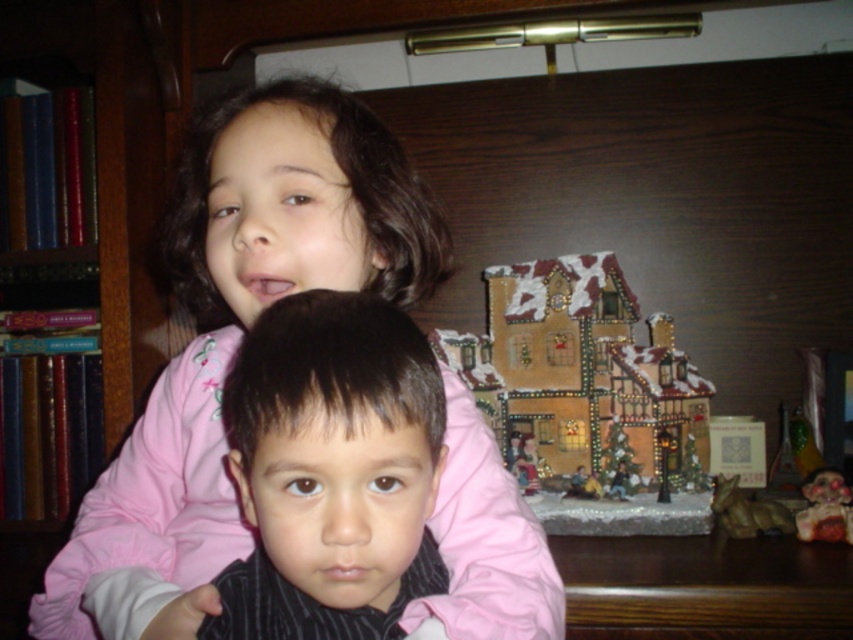
Question: Can you confirm if matte pink shirt at upper center is positioned to the right of black striped shirt at center?

Choices:
 (A) yes
 (B) no

Answer: (B)

Question: Which point is farther to the camera?

Choices:
 (A) matte pink shirt at upper center
 (B) wooden bookshelf at left

Answer: (B)

Question: Can you confirm if black striped shirt at center is positioned to the left of wooden bookshelf at left?

Choices:
 (A) yes
 (B) no

Answer: (B)

Question: Which of the following is the closest to the observer?

Choices:
 (A) matte pink shirt at upper center
 (B) black striped shirt at center

Answer: (B)

Question: Which point is farther from the camera taking this photo?

Choices:
 (A) (152, 282)
 (B) (317, 362)

Answer: (A)

Question: Does matte pink shirt at upper center appear over wooden bookshelf at left?

Choices:
 (A) no
 (B) yes

Answer: (A)